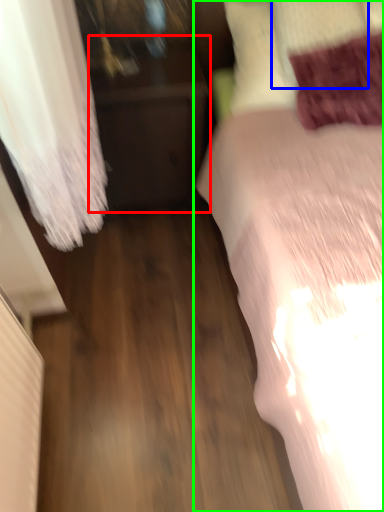
Question: Which object is positioned farthest from furniture (highlighted by a red box)? Select from pillow (highlighted by a blue box) and bed (highlighted by a green box).

Choices:
 (A) pillow
 (B) bed

Answer: (A)